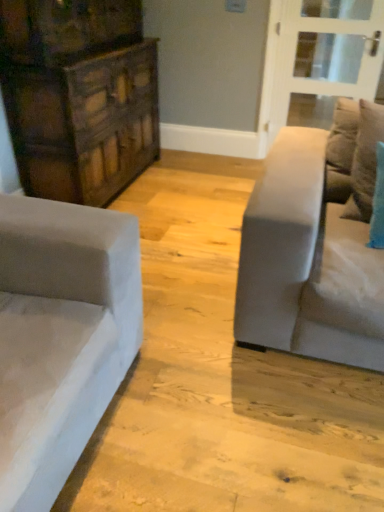
Question: Can you confirm if velvet teal pillow at right is taller than dark wood dresser at left?

Choices:
 (A) yes
 (B) no

Answer: (B)

Question: Is velvet teal pillow at right positioned with its back to dark wood dresser at left?

Choices:
 (A) no
 (B) yes

Answer: (A)

Question: From a real-world perspective, is velvet teal pillow at right on top of dark wood dresser at left?

Choices:
 (A) no
 (B) yes

Answer: (B)

Question: Does velvet teal pillow at right have a greater width compared to dark wood dresser at left?

Choices:
 (A) no
 (B) yes

Answer: (A)

Question: Is velvet teal pillow at right further to camera compared to dark wood dresser at left?

Choices:
 (A) no
 (B) yes

Answer: (A)

Question: From a real-world perspective, is dark wood dresser at left physically located above or below clear glass door at upper right?

Choices:
 (A) below
 (B) above

Answer: (B)

Question: Looking at their shapes, would you say dark wood dresser at left is wider or thinner than clear glass door at upper right?

Choices:
 (A) thin
 (B) wide

Answer: (B)

Question: Is dark wood dresser at left situated inside clear glass door at upper right or outside?

Choices:
 (A) inside
 (B) outside

Answer: (B)

Question: Considering the positions of dark wood dresser at left and clear glass door at upper right in the image, is dark wood dresser at left taller or shorter than clear glass door at upper right?

Choices:
 (A) tall
 (B) short

Answer: (A)

Question: From a real-world perspective, is clear glass door at upper right positioned above or below light gray fabric couch at right?

Choices:
 (A) below
 (B) above

Answer: (B)

Question: In terms of size, does clear glass door at upper right appear bigger or smaller than light gray fabric couch at right?

Choices:
 (A) small
 (B) big

Answer: (A)

Question: Would you say clear glass door at upper right is inside or outside light gray fabric couch at right?

Choices:
 (A) outside
 (B) inside

Answer: (A)

Question: In the image, is clear glass door at upper right on the left side or the right side of light gray fabric couch at right?

Choices:
 (A) right
 (B) left

Answer: (A)

Question: Is light gray fabric couch at right taller or shorter than dark wood dresser at left?

Choices:
 (A) tall
 (B) short

Answer: (B)

Question: Considering the relative positions of light gray fabric couch at right and dark wood dresser at left in the image provided, is light gray fabric couch at right to the left or to the right of dark wood dresser at left?

Choices:
 (A) left
 (B) right

Answer: (B)